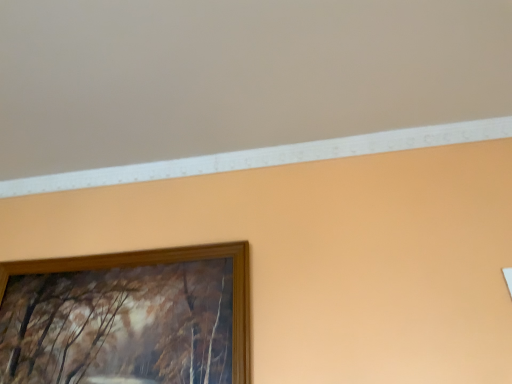
The width and height of the screenshot is (512, 384). I want to click on wooden picture frame at upper left, so click(x=163, y=263).

What do you see at coordinates (163, 263) in the screenshot? The width and height of the screenshot is (512, 384). I see `wooden picture frame at upper left` at bounding box center [163, 263].

Image resolution: width=512 pixels, height=384 pixels. In order to click on wooden picture frame at upper left in this screenshot , I will do `click(163, 263)`.